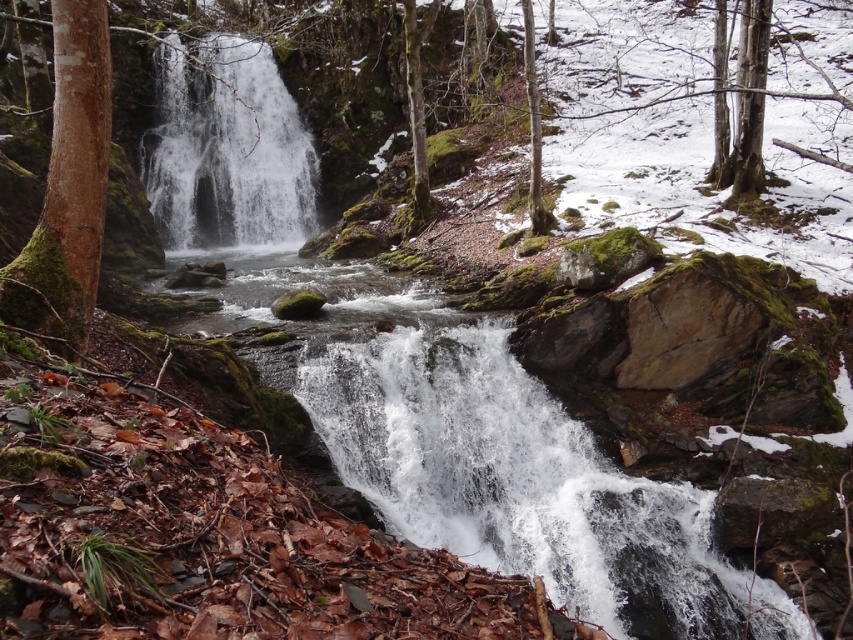
You are standing at the viewpoint overlooking the winter landscape. There is a specific point marked at coordinates point [682,504]. If you want to place a small weatherproof sign at this point to indicate the location of the smaller foreground waterfall, will the sign be placed correctly?

The point [682,504] is 9.91 meters away from viewer, so the sign will be placed correctly at this point as it corresponds to the location of the smaller foreground waterfall.